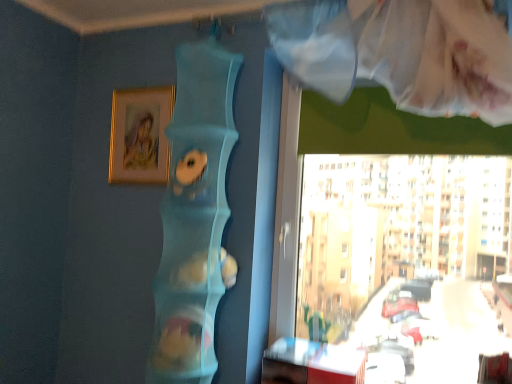
You are a GUI agent. You are given a task and a screenshot of the screen. Output one action in this format:
    pyautogui.click(x=<x>, y=<y>)
    Task: Click on the wooden table at lower right
    
    Given the screenshot: What is the action you would take?
    pos(311,363)

This screenshot has height=384, width=512. Describe the element at coordinates (311, 363) in the screenshot. I see `wooden table at lower right` at that location.

This screenshot has height=384, width=512. I want to click on gold metallic picture frame at upper left, so [140, 135].

The width and height of the screenshot is (512, 384). What do you see at coordinates (140, 135) in the screenshot?
I see `gold metallic picture frame at upper left` at bounding box center [140, 135].

The height and width of the screenshot is (384, 512). I want to click on wooden table at lower right, so click(x=311, y=363).

Consider the image. Which is more to the right, wooden table at lower right or gold metallic picture frame at upper left?

From the viewer's perspective, wooden table at lower right appears more on the right side.

Is wooden table at lower right further to camera compared to gold metallic picture frame at upper left?

No, it is not.

Which is closer, (318, 349) or (134, 156)?

The point (318, 349) is more forward.

From the image's perspective, which object appears higher, wooden table at lower right or gold metallic picture frame at upper left?

gold metallic picture frame at upper left, from the image's perspective.

From a real-world perspective, is wooden table at lower right below gold metallic picture frame at upper left?

Indeed, from a real-world perspective, wooden table at lower right is positioned beneath gold metallic picture frame at upper left.

Considering the sizes of objects wooden table at lower right and gold metallic picture frame at upper left in the image provided, who is wider, wooden table at lower right or gold metallic picture frame at upper left?

Wider between the two is wooden table at lower right.

In terms of height, does wooden table at lower right look taller or shorter compared to gold metallic picture frame at upper left?

wooden table at lower right is shorter than gold metallic picture frame at upper left.

Considering the relative sizes of wooden table at lower right and gold metallic picture frame at upper left in the image provided, is wooden table at lower right bigger than gold metallic picture frame at upper left?

Indeed, wooden table at lower right has a larger size compared to gold metallic picture frame at upper left.

Can gold metallic picture frame at upper left be found inside wooden table at lower right?

No, gold metallic picture frame at upper left is not inside wooden table at lower right.

Would you say wooden table at lower right is a long distance from gold metallic picture frame at upper left?

Yes, wooden table at lower right and gold metallic picture frame at upper left are located far from each other.

Does wooden table at lower right turn towards gold metallic picture frame at upper left?

No, wooden table at lower right is not aimed at gold metallic picture frame at upper left.

How many degrees apart are the facing directions of wooden table at lower right and gold metallic picture frame at upper left?

There is a 1.19-degree angle between the facing directions of wooden table at lower right and gold metallic picture frame at upper left.

Measure the distance from wooden table at lower right to gold metallic picture frame at upper left.

wooden table at lower right is 1.06 meters away from gold metallic picture frame at upper left.

Where is `table in front of the gold metallic picture frame at upper left`? table in front of the gold metallic picture frame at upper left is located at coordinates (311, 363).

Is gold metallic picture frame at upper left at the left side of wooden table at lower right?

Indeed, gold metallic picture frame at upper left is positioned on the left side of wooden table at lower right.

Is gold metallic picture frame at upper left in front of wooden table at lower right?

No, it is behind wooden table at lower right.

Which is closer to the camera, (153,162) or (296,372)?

The point (296,372) is closer to the camera.

From the image's perspective, would you say gold metallic picture frame at upper left is shown under wooden table at lower right?

Incorrect, from the image's perspective, gold metallic picture frame at upper left is higher than wooden table at lower right.

From a real-world perspective, who is located higher, gold metallic picture frame at upper left or wooden table at lower right?

gold metallic picture frame at upper left is physically above.

Consider the image. Can you confirm if gold metallic picture frame at upper left is thinner than wooden table at lower right?

Yes.

Can you confirm if gold metallic picture frame at upper left is shorter than wooden table at lower right?

No.

Which of these two, gold metallic picture frame at upper left or wooden table at lower right, is bigger?

With larger size is wooden table at lower right.

Can we say gold metallic picture frame at upper left lies outside wooden table at lower right?

Yes.

Is gold metallic picture frame at upper left next to wooden table at lower right and touching it?

There is a gap between gold metallic picture frame at upper left and wooden table at lower right.

Does gold metallic picture frame at upper left turn towards wooden table at lower right?

No.

How far apart are gold metallic picture frame at upper left and wooden table at lower right?

gold metallic picture frame at upper left and wooden table at lower right are 1.06 meters apart from each other.

The width and height of the screenshot is (512, 384). I want to click on picture frame on the left of wooden table at lower right, so click(140, 135).

Where is `table on the right side of gold metallic picture frame at upper left`? This screenshot has height=384, width=512. table on the right side of gold metallic picture frame at upper left is located at coordinates [x=311, y=363].

Locate an element on the screen. This screenshot has width=512, height=384. table beneath the gold metallic picture frame at upper left (from a real-world perspective) is located at coordinates (311, 363).